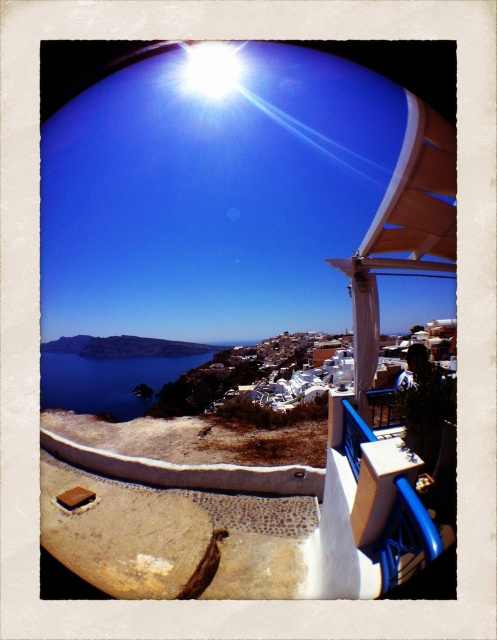
Question: Which point is farther from the camera taking this photo?

Choices:
 (A) (84, 406)
 (B) (152, 147)

Answer: (A)

Question: Is the position of white matte terrace at upper center less distant than that of blue water at lower left?

Choices:
 (A) yes
 (B) no

Answer: (A)

Question: Among these objects, which one is farthest from the camera?

Choices:
 (A) blue water at lower left
 (B) white matte terrace at upper center

Answer: (A)

Question: Can you confirm if white matte terrace at upper center is positioned below blue water at lower left?

Choices:
 (A) no
 (B) yes

Answer: (A)

Question: Can you confirm if white matte terrace at upper center is positioned to the right of blue water at lower left?

Choices:
 (A) yes
 (B) no

Answer: (A)